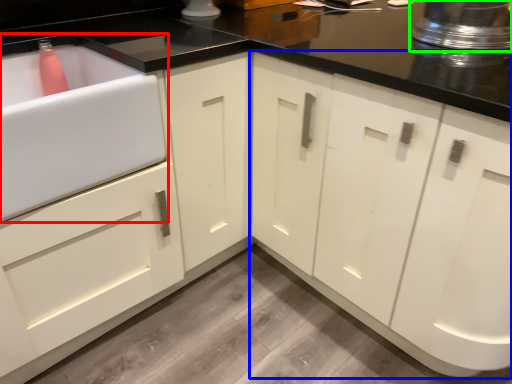
Question: Based on their relative distances, which object is nearer to sink (highlighted by a red box)? Choose from cabinetry (highlighted by a blue box) and appliance (highlighted by a green box).

Choices:
 (A) cabinetry
 (B) appliance

Answer: (A)